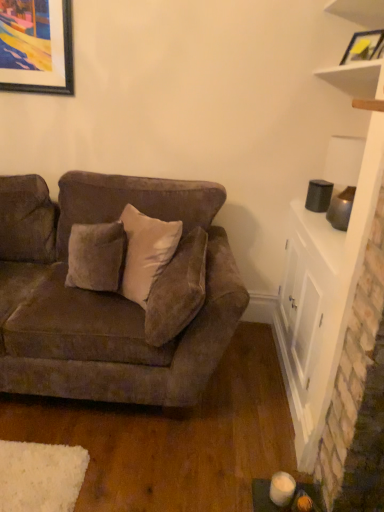
Question: Is matte yellow picture frame at upper right next to white glossy cabinet at right?

Choices:
 (A) no
 (B) yes

Answer: (A)

Question: Is matte yellow picture frame at upper right surrounding white glossy cabinet at right?

Choices:
 (A) yes
 (B) no

Answer: (B)

Question: From a real-world perspective, is matte yellow picture frame at upper right below white glossy cabinet at right?

Choices:
 (A) no
 (B) yes

Answer: (A)

Question: Is matte yellow picture frame at upper right taller than white glossy cabinet at right?

Choices:
 (A) no
 (B) yes

Answer: (A)

Question: Does matte yellow picture frame at upper right lie in front of white glossy cabinet at right?

Choices:
 (A) no
 (B) yes

Answer: (A)

Question: Considering the positions of suede-like beige pillow at center and suede brown couch at center in the image, is suede-like beige pillow at center wider or thinner than suede brown couch at center?

Choices:
 (A) thin
 (B) wide

Answer: (A)

Question: Considering the positions of point click(160, 320) and point click(31, 286), is point click(160, 320) closer or farther from the camera than point click(31, 286)?

Choices:
 (A) closer
 (B) farther

Answer: (A)

Question: Is suede-like beige pillow at center in front of or behind suede brown couch at center in the image?

Choices:
 (A) behind
 (B) front

Answer: (B)

Question: In terms of size, does suede-like beige pillow at center appear bigger or smaller than suede brown couch at center?

Choices:
 (A) big
 (B) small

Answer: (B)

Question: From their relative heights in the image, would you say matte yellow picture frame at upper right is taller or shorter than suede-like beige pillow at center?

Choices:
 (A) tall
 (B) short

Answer: (B)

Question: In the image, is matte yellow picture frame at upper right on the left side or the right side of suede-like beige pillow at center?

Choices:
 (A) right
 (B) left

Answer: (A)

Question: From a real-world perspective, is matte yellow picture frame at upper right above or below suede-like beige pillow at center?

Choices:
 (A) below
 (B) above

Answer: (B)

Question: Relative to suede-like beige pillow at center, is matte yellow picture frame at upper right in front or behind?

Choices:
 (A) front
 (B) behind

Answer: (B)

Question: Is matte yellow picture frame at upper right inside the boundaries of suede brown couch at center, or outside?

Choices:
 (A) inside
 (B) outside

Answer: (B)

Question: From their relative heights in the image, would you say matte yellow picture frame at upper right is taller or shorter than suede brown couch at center?

Choices:
 (A) tall
 (B) short

Answer: (B)